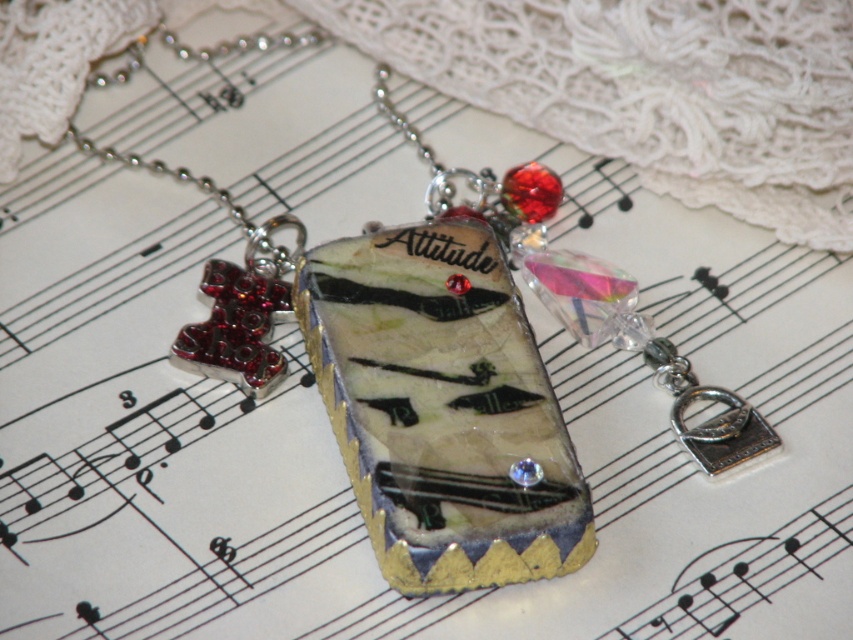
You are an artist who wants to place a sticker exactly at the center of the translucent resin pendant at center. According to the coordinates provided, what are the exact coordinates where you should place the sticker?

The exact coordinates to place the sticker at the center of the translucent resin pendant at center are point (442, 408).

You are an app that detects the position of two points on an image. You need to determine if one point is in front of the other. Given the points point (354, 477) and point (498, 218), which one is closer to the viewer?

Point (354, 477) is in front of point (498, 218), so it is closer to the viewer.

You are an appraiser examining two pendants on a necklace displayed on a sheet of music. The pendants are labeled as translucent resin pendant at center and translucent glass pendant at center. Based on their sizes, which pendant would you recommend for a client who prefers a more subtle, understated accessory?

The translucent resin pendant at center is smaller than the translucent glass pendant at center, so the translucent resin pendant at center would be more suitable for a client preferring a subtle, understated accessory.